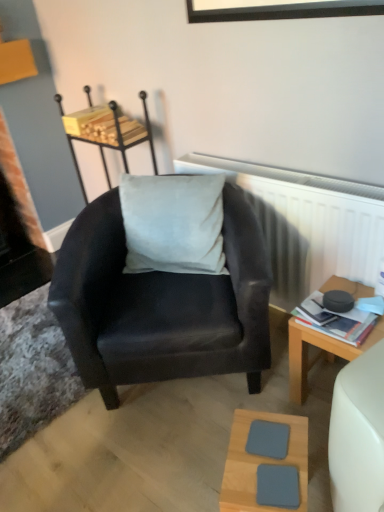
Question: Is wooden desk at right shorter than light wood/texture square coaster at lower center?

Choices:
 (A) no
 (B) yes

Answer: (A)

Question: Is the position of wooden desk at right less distant than that of light wood/texture square coaster at lower center?

Choices:
 (A) no
 (B) yes

Answer: (A)

Question: Is wooden desk at right not near light wood/texture square coaster at lower center?

Choices:
 (A) no
 (B) yes

Answer: (A)

Question: From the image's perspective, does wooden desk at right appear lower than light wood/texture square coaster at lower center?

Choices:
 (A) yes
 (B) no

Answer: (B)

Question: Can you confirm if wooden desk at right is bigger than light wood/texture square coaster at lower center?

Choices:
 (A) yes
 (B) no

Answer: (A)

Question: Considering the relative sizes of wooden desk at right and light wood/texture square coaster at lower center in the image provided, is wooden desk at right thinner than light wood/texture square coaster at lower center?

Choices:
 (A) yes
 (B) no

Answer: (B)

Question: Considering the relative positions of light wood/texture square coaster at lower center and suede black armchair at center in the image provided, is light wood/texture square coaster at lower center to the right of suede black armchair at center from the viewer's perspective?

Choices:
 (A) yes
 (B) no

Answer: (A)

Question: Can you confirm if light wood/texture square coaster at lower center is smaller than suede black armchair at center?

Choices:
 (A) no
 (B) yes

Answer: (B)

Question: Does light wood/texture square coaster at lower center turn towards suede black armchair at center?

Choices:
 (A) yes
 (B) no

Answer: (B)

Question: From a real-world perspective, is light wood/texture square coaster at lower center physically below suede black armchair at center?

Choices:
 (A) yes
 (B) no

Answer: (A)

Question: Is light wood/texture square coaster at lower center far from suede black armchair at center?

Choices:
 (A) no
 (B) yes

Answer: (A)

Question: Is the position of light wood/texture square coaster at lower center more distant than that of suede black armchair at center?

Choices:
 (A) yes
 (B) no

Answer: (B)

Question: Is suede black armchair at center aimed at wooden desk at right?

Choices:
 (A) no
 (B) yes

Answer: (A)